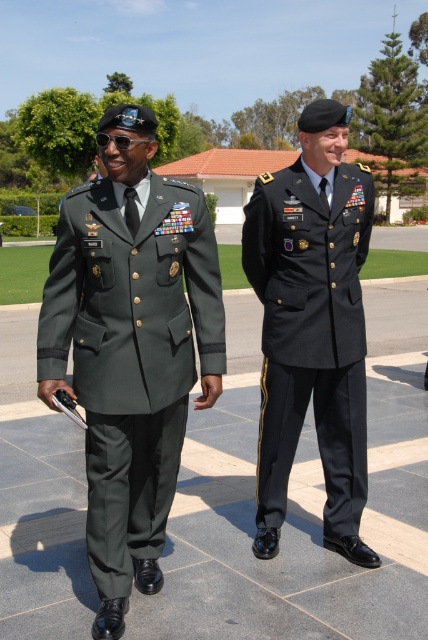
Can you confirm if green fabric uniform at left is positioned to the left of black matte uniform at center?

Yes, green fabric uniform at left is to the left of black matte uniform at center.

Can you confirm if green fabric uniform at left is positioned to the right of black matte uniform at center?

Incorrect, green fabric uniform at left is not on the right side of black matte uniform at center.

Between point (95, 509) and point (247, 269), which one is positioned in front?

Point (95, 509) is more forward.

The image size is (428, 640). Find the location of `green fabric uniform at left`. green fabric uniform at left is located at coordinates (130, 355).